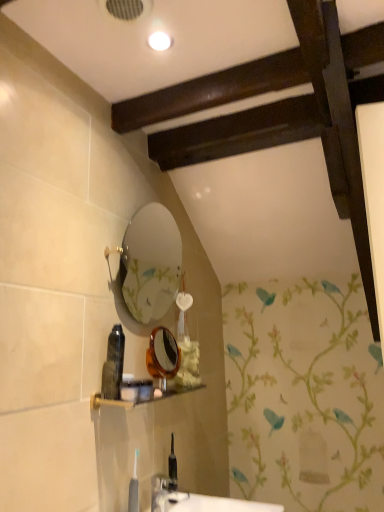
Question: Would you say translucent plastic toothbrush at lower center, the second toiletry ordered from the bottom, is inside or outside translucent plastic bottle at center, marked as the 4th toiletry in a bottom-to-top arrangement?

Choices:
 (A) inside
 (B) outside

Answer: (B)

Question: Is translucent plastic toothbrush at lower center, the third toiletry when ordered from top to bottom, to the left or to the right of translucent plastic bottle at center, which appears as the 1th toiletry when viewed from the top, in the image?

Choices:
 (A) left
 (B) right

Answer: (B)

Question: Which object is the closest to the blue plastic toothbrush at lower center, acting as the 1th toiletry starting from the bottom?

Choices:
 (A) translucent plastic bottle at center, which appears as the 1th toiletry when viewed from the top
 (B) matte plastic shelf at lower center
 (C) translucent plastic toothbrush at lower center, the third toiletry when ordered from top to bottom
 (D) translucent plastic tube at center, the 2th toiletry from the top
 (E) translucent amber mirror at center

Answer: (D)

Question: Which is nearer to the translucent plastic bottle at center, marked as the 4th toiletry in a bottom-to-top arrangement?

Choices:
 (A) translucent amber mirror at center
 (B) matte plastic shelf at lower center
 (C) translucent plastic toothbrush at lower center, the third toiletry when ordered from top to bottom
 (D) translucent plastic tube at center, acting as the third toiletry starting from the bottom
 (E) blue plastic toothbrush at lower center, acting as the 1th toiletry starting from the bottom

Answer: (D)